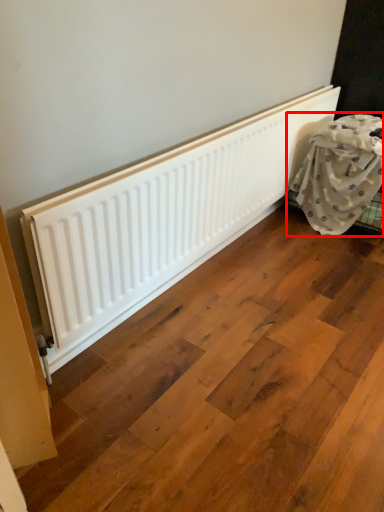
Question: From the image, what is the correct spatial relationship of furniture (annotated by the red box) in relation to radiator?

Choices:
 (A) right
 (B) left

Answer: (A)